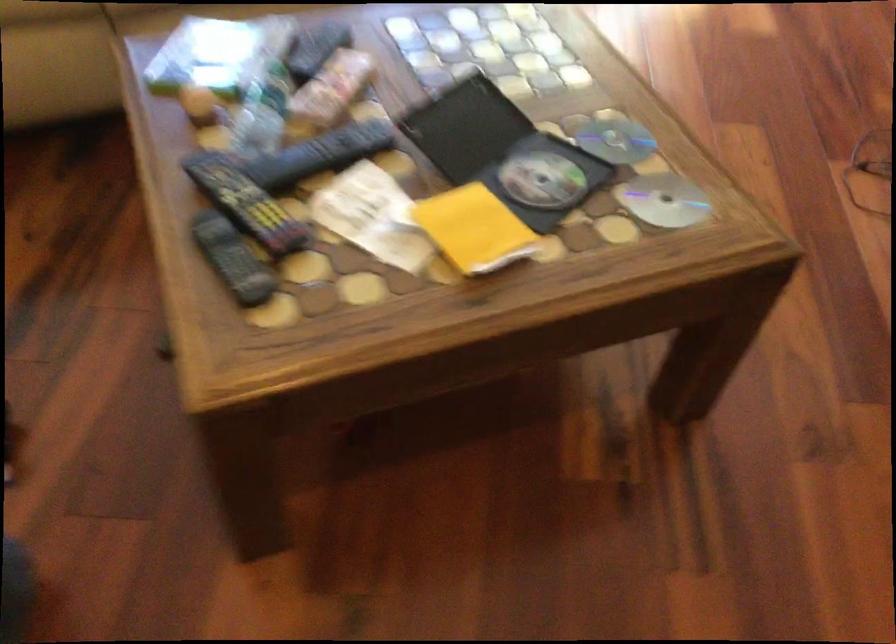
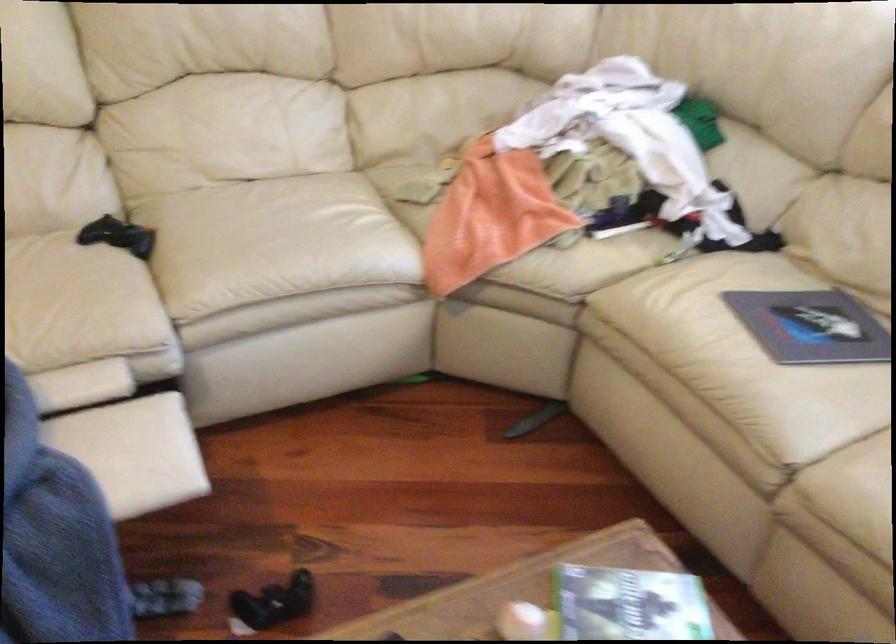
Question: The camera is either moving clockwise (left) or counter-clockwise (right) around the object. The first image is from the beginning of the video and the second image is from the end. Is the camera moving left or right when shooting the video?

Choices:
 (A) Left
 (B) Right

Answer: (B)